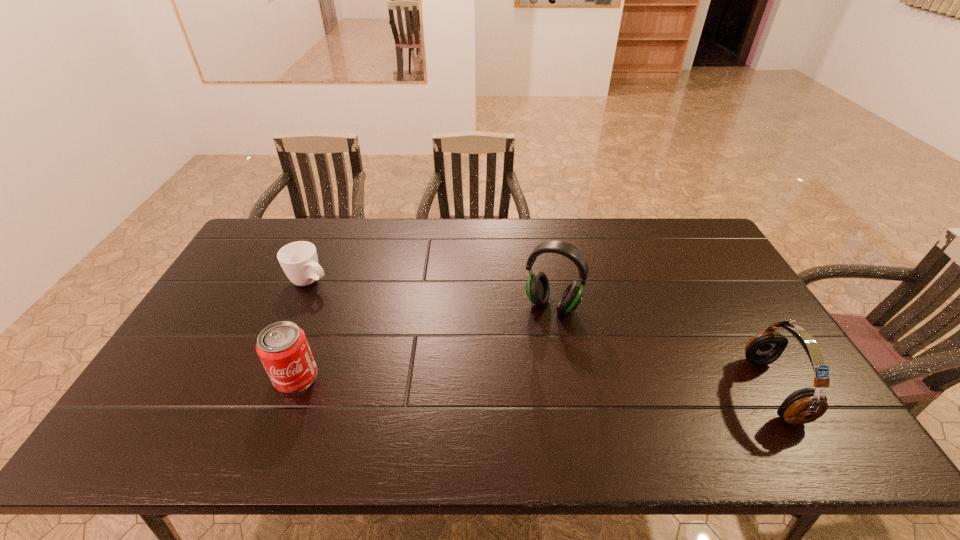
Locate an element on the screen. The height and width of the screenshot is (540, 960). can is located at coordinates (282, 347).

Find the location of `the shorter headset`. the shorter headset is located at coordinates (803, 406).

Find the location of `the right headset`. the right headset is located at coordinates (803, 406).

Find the location of a particular element. The image size is (960, 540). the shortest object is located at coordinates (299, 261).

Image resolution: width=960 pixels, height=540 pixels. Identify the location of the farther headset. (537, 288).

Locate an element on the screen. the taller headset is located at coordinates (537, 288).

Where is `blank space located 0.160m on the back of the second shortest object`? blank space located 0.160m on the back of the second shortest object is located at coordinates (319, 317).

Where is `vacant area located 0.300m with the handle on the side of the shortest object`? The height and width of the screenshot is (540, 960). vacant area located 0.300m with the handle on the side of the shortest object is located at coordinates (398, 327).

This screenshot has width=960, height=540. What are the coordinates of `vacant space located 0.360m with the handle on the side of the shortest object` in the screenshot? It's located at (415, 335).

Identify the location of free point located 0.110m with the handle on the side of the shortest object. (351, 301).